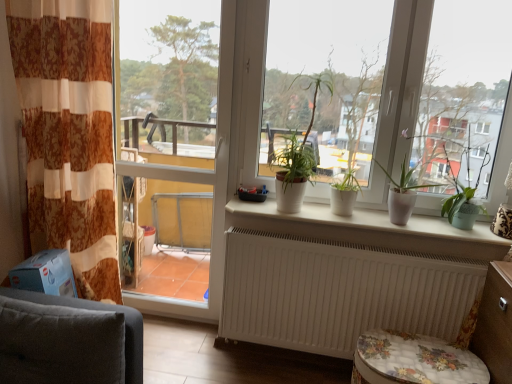
Question: From the image's perspective, is transparent glass screen door at left under white matte window at center?

Choices:
 (A) no
 (B) yes

Answer: (B)

Question: Can you see transparent glass screen door at left touching white matte window at center?

Choices:
 (A) yes
 (B) no

Answer: (B)

Question: Is transparent glass screen door at left not within white matte window at center?

Choices:
 (A) yes
 (B) no

Answer: (A)

Question: Can you confirm if transparent glass screen door at left is bigger than white matte window at center?

Choices:
 (A) no
 (B) yes

Answer: (A)

Question: Can you confirm if transparent glass screen door at left is taller than white matte window at center?

Choices:
 (A) no
 (B) yes

Answer: (B)

Question: From their relative heights in the image, would you say dark gray fabric armchair at lower left is taller or shorter than white matte pot at center, which is the 3th houseplant in left-to-right order?

Choices:
 (A) tall
 (B) short

Answer: (A)

Question: Looking at their shapes, would you say dark gray fabric armchair at lower left is wider or thinner than white matte pot at center, which is the 3th houseplant in left-to-right order?

Choices:
 (A) wide
 (B) thin

Answer: (B)

Question: Is dark gray fabric armchair at lower left in front of or behind white matte pot at center, which is the 3th houseplant in left-to-right order, in the image?

Choices:
 (A) front
 (B) behind

Answer: (A)

Question: From the image's perspective, relative to white matte pot at center, which is the 3th houseplant in left-to-right order, is dark gray fabric armchair at lower left above or below?

Choices:
 (A) below
 (B) above

Answer: (A)

Question: From the image's perspective, relative to green matte plant at right, is white matte pot at center, marked as the second houseplant in a right-to-left arrangement, above or below?

Choices:
 (A) below
 (B) above

Answer: (B)

Question: Relative to green matte plant at right, is white matte pot at center, marked as the second houseplant in a right-to-left arrangement, in front or behind?

Choices:
 (A) front
 (B) behind

Answer: (B)

Question: From their relative heights in the image, would you say white matte pot at center, which is the 2th houseplant from left to right, is taller or shorter than green matte plant at right?

Choices:
 (A) short
 (B) tall

Answer: (A)

Question: Looking at their shapes, would you say white matte pot at center, marked as the second houseplant in a right-to-left arrangement, is wider or thinner than green matte plant at right?

Choices:
 (A) wide
 (B) thin

Answer: (B)

Question: Relative to dark gray fabric armchair at lower left, is white matte pot at center, which is the 2th houseplant from left to right, in front or behind?

Choices:
 (A) front
 (B) behind

Answer: (B)

Question: In terms of size, does white matte pot at center, marked as the second houseplant in a right-to-left arrangement, appear bigger or smaller than dark gray fabric armchair at lower left?

Choices:
 (A) small
 (B) big

Answer: (A)